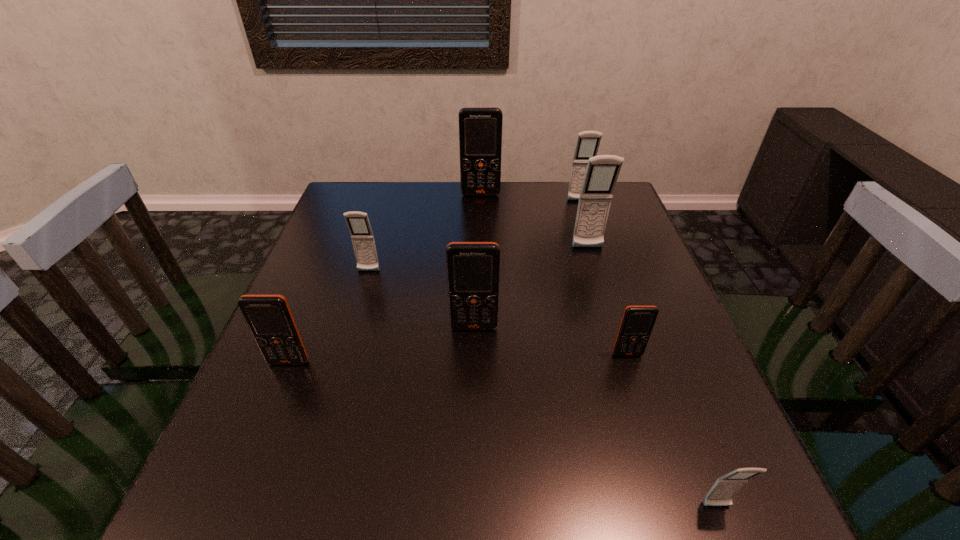
Find the location of `the leftmost orange cellular telephone`. the leftmost orange cellular telephone is located at coordinates (269, 318).

Find the location of `the third biggest orange cellular telephone`. the third biggest orange cellular telephone is located at coordinates [x=269, y=318].

Where is `the smallest orange cellular telephone`? the smallest orange cellular telephone is located at coordinates (637, 323).

I want to click on the rightmost orange cellular telephone, so click(637, 323).

This screenshot has height=540, width=960. What are the coordinates of `the nearest object` in the screenshot? It's located at (725, 488).

Where is `the nearest cellular telephone`? The height and width of the screenshot is (540, 960). the nearest cellular telephone is located at coordinates click(725, 488).

Find the location of a particular element. free spot located 0.370m on the screen of the farthest object is located at coordinates (481, 276).

The image size is (960, 540). I want to click on vacant region located 0.170m on the front-facing side of the biggest gray cellular telephone, so pyautogui.click(x=603, y=297).

Locate an element on the screen. The image size is (960, 540). vacant space located 0.160m on the front-facing side of the seventh nearest object is located at coordinates (589, 234).

Locate an element on the screen. The width and height of the screenshot is (960, 540). vacant region located on the screen of the fifth farthest cellular telephone is located at coordinates (473, 410).